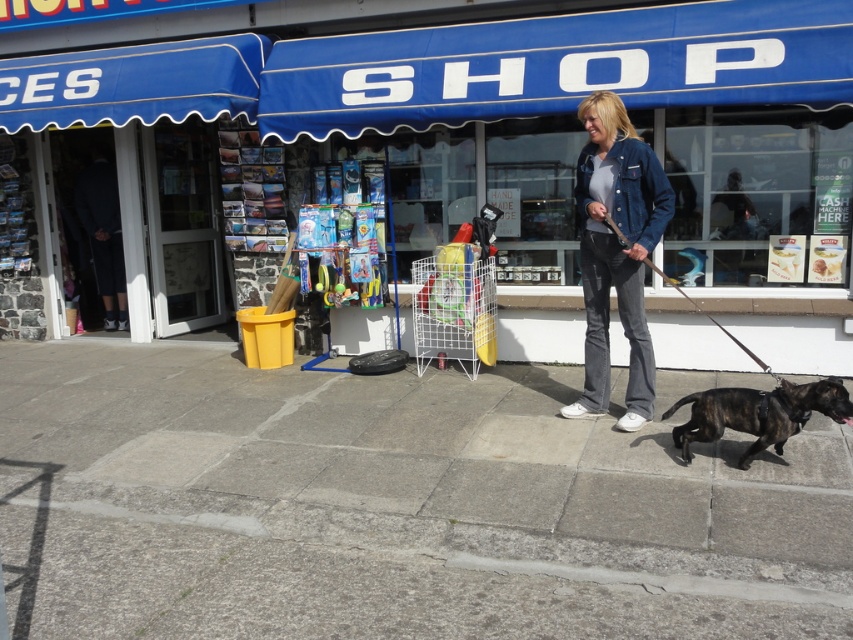
Is point (276, 35) more distant than point (564, 500)?

Yes, point (276, 35) is behind point (564, 500).

Does blue fabric awning at upper center have a greater height compared to gray concrete pavement at lower center?

Indeed, blue fabric awning at upper center has a greater height compared to gray concrete pavement at lower center.

This screenshot has height=640, width=853. In order to click on blue fabric awning at upper center in this screenshot , I will do `click(428, 150)`.

Does blue fabric awning at upper center have a greater width compared to brindle fur dog at lower right?

Yes.

Is point (788, 262) positioned in front of point (685, 444)?

No.

The image size is (853, 640). I want to click on blue fabric awning at upper center, so (428, 150).

The height and width of the screenshot is (640, 853). What are the coordinates of `blue fabric awning at upper center` in the screenshot? It's located at (428, 150).

Does point (758, 42) lie behind point (596, 134)?

Yes, it is behind point (596, 134).

Is point (804, 316) in front of point (624, 292)?

No, it is behind (624, 292).

Find the location of a particular element. Image resolution: width=853 pixels, height=640 pixels. blue fabric awning at upper center is located at coordinates 428,150.

In order to click on blue fabric awning at upper center in this screenshot , I will do `click(428, 150)`.